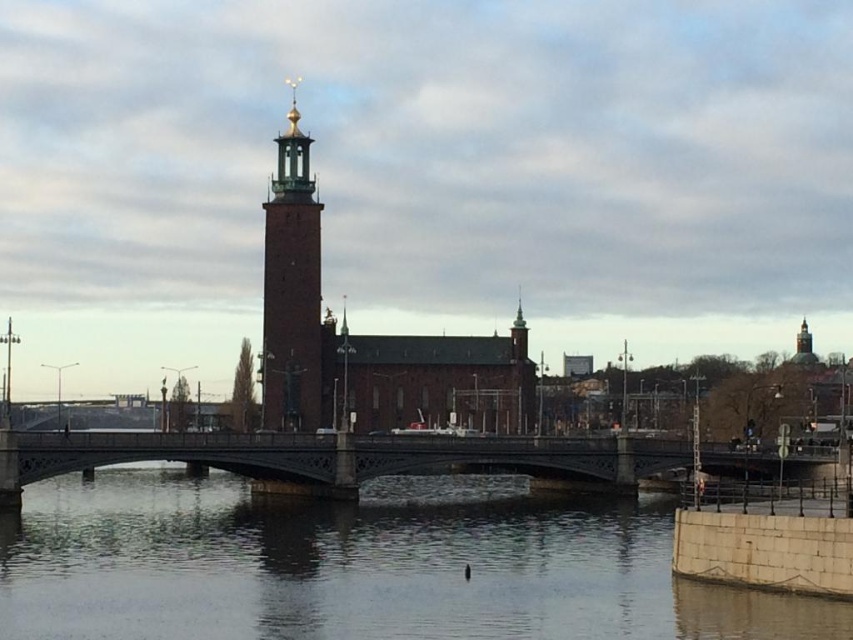
Question: Is the position of clear water at bridge center more distant than that of brick tower at center?

Choices:
 (A) no
 (B) yes

Answer: (A)

Question: Among these points, which one is farthest from the camera?

Choices:
 (A) (722, 596)
 (B) (279, 433)

Answer: (B)

Question: Which point is farther from the camera taking this photo?

Choices:
 (A) (274, 280)
 (B) (474, 438)

Answer: (A)

Question: Which object appears closest to the camera in this image?

Choices:
 (A) clear water at bridge center
 (B) dark gray stone bridge at center
 (C) brick tower at center

Answer: (A)

Question: Can you confirm if clear water at bridge center is bigger than brick tower at center?

Choices:
 (A) yes
 (B) no

Answer: (B)

Question: Observing the image, what is the correct spatial positioning of clear water at bridge center in reference to dark gray stone bridge at center?

Choices:
 (A) left
 (B) right

Answer: (A)